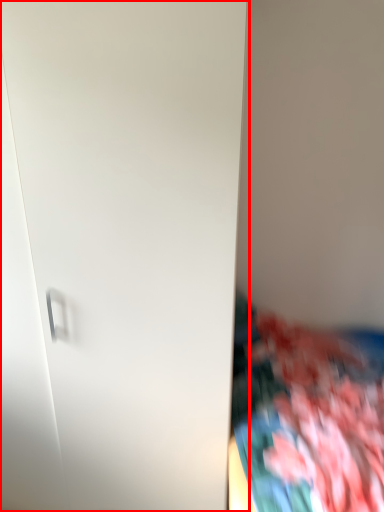
Question: Where is door (annotated by the red box) located in relation to textile in the image?

Choices:
 (A) right
 (B) left

Answer: (B)